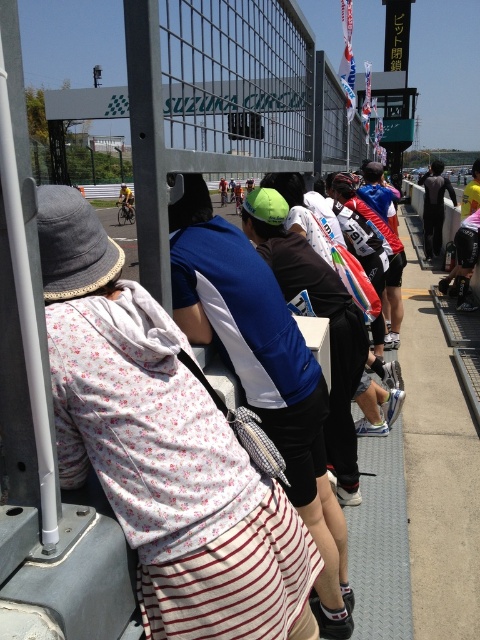
Question: Can you confirm if floral fabric dress at center is positioned to the right of blue/white jersey at center?

Choices:
 (A) no
 (B) yes

Answer: (A)

Question: Which object is farther from the camera taking this photo?

Choices:
 (A) yellow jersey at center
 (B) blue/white jersey at center
 (C) black matte wetsuit at center

Answer: (A)

Question: Which of the following is the farthest from the observer?

Choices:
 (A) (432, 211)
 (B) (123, 184)
 (C) (336, 592)

Answer: (B)

Question: Which object is positioned farthest from the blue/white jersey at center?

Choices:
 (A) black matte wetsuit at center
 (B) yellow jersey at center
 (C) floral fabric dress at center

Answer: (B)

Question: Does blue/white jersey at center appear under yellow jersey at center?

Choices:
 (A) yes
 (B) no

Answer: (A)

Question: Can you confirm if blue/white jersey at center is positioned to the right of yellow jersey at center?

Choices:
 (A) yes
 (B) no

Answer: (A)